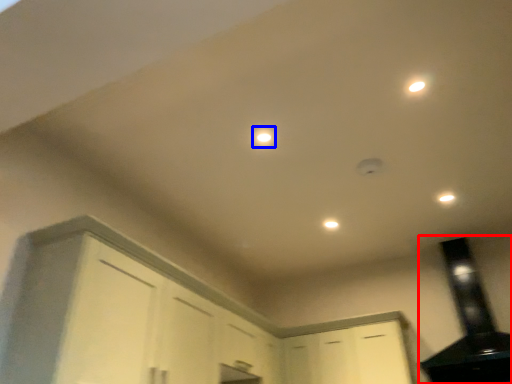
Question: Among these objects, which one is nearest to the camera, exhaust hood (highlighted by a red box) or light (highlighted by a blue box)?

Choices:
 (A) exhaust hood
 (B) light

Answer: (B)